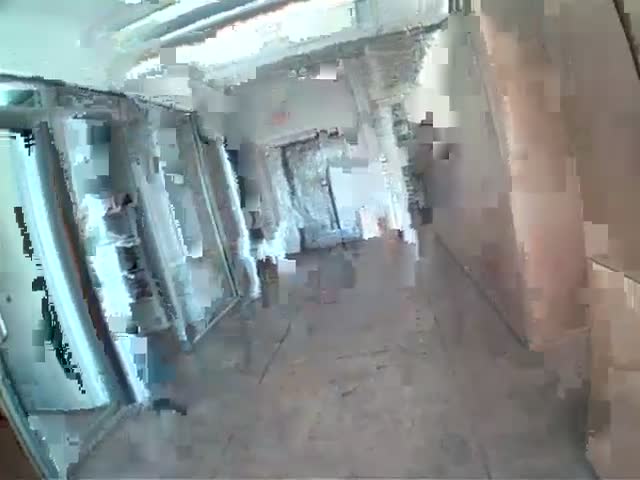
This screenshot has height=480, width=640. Identify the location of light on ceiling. (283, 24).